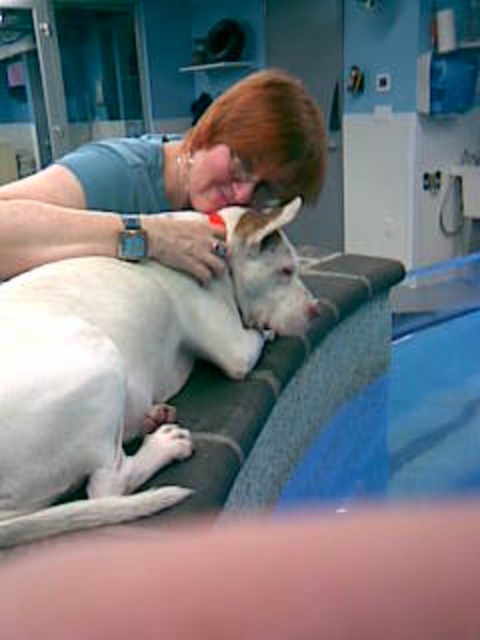
Question: Can you confirm if white smooth dog at center is wider than matte gray shirt at upper center?

Choices:
 (A) yes
 (B) no

Answer: (B)

Question: Can you confirm if white smooth dog at center is positioned below matte gray shirt at upper center?

Choices:
 (A) no
 (B) yes

Answer: (B)

Question: Which object appears farthest from the camera in this image?

Choices:
 (A) white smooth dog at center
 (B) matte gray shirt at upper center

Answer: (B)

Question: Is white smooth dog at center below matte gray shirt at upper center?

Choices:
 (A) no
 (B) yes

Answer: (B)

Question: Which object appears farthest from the camera in this image?

Choices:
 (A) matte gray shirt at upper center
 (B) white smooth dog at center

Answer: (A)